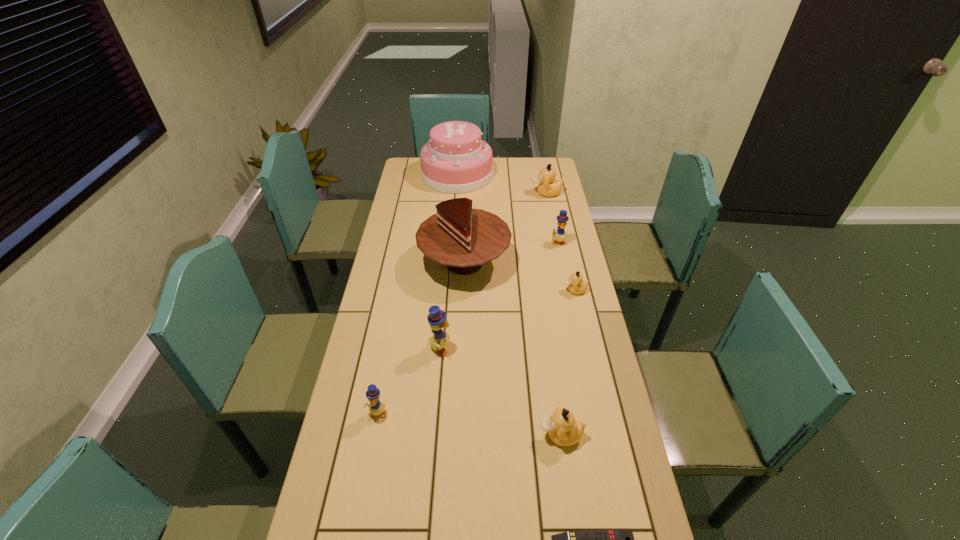
The image size is (960, 540). Find the location of `birthday cake`. birthday cake is located at coordinates (455, 160).

Identify the location of red cake. Image resolution: width=960 pixels, height=540 pixels. (463, 238).

Identify the location of the fourth farthest duckling. The height and width of the screenshot is (540, 960). [x=436, y=318].

I want to click on the sixth farthest object, so click(436, 318).

Find the location of a particular element. The image size is (960, 540). the biggest tan duckling is located at coordinates (548, 187).

Find the location of a particular element. The height and width of the screenshot is (540, 960). the farthest tan duckling is located at coordinates (548, 187).

Find the location of `the second farthest duckling`. the second farthest duckling is located at coordinates (560, 235).

Locate an element on the screen. the second biggest yellow duckling is located at coordinates (560, 235).

Locate an element on the screen. The image size is (960, 540). the second biggest tan duckling is located at coordinates (564, 430).

At what (x,y) coordinates should I click in order to perform the action: click on the nearest duckling. Please return your answer as a coordinate pair (x, y). The image size is (960, 540). Looking at the image, I should click on (564, 430).